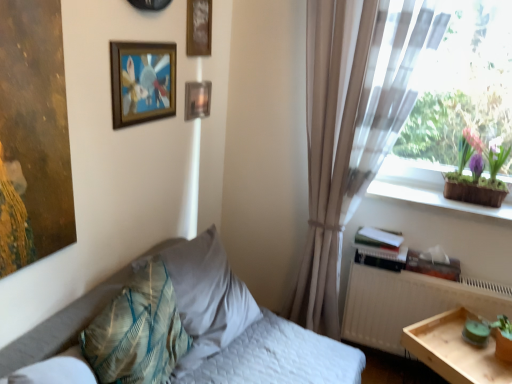
Question: From their relative heights in the image, would you say textured beige pillow at center-left, arranged as the second pillow when viewed from the front, is taller or shorter than white matte radiator at right?

Choices:
 (A) tall
 (B) short

Answer: (B)

Question: Looking at the image, does textured beige pillow at center-left, arranged as the second pillow when viewed from the front, seem bigger or smaller compared to white matte radiator at right?

Choices:
 (A) big
 (B) small

Answer: (A)

Question: Which of these objects is positioned farthest from the textured beige pillow at center-left, the 1th pillow when ordered from back to front?

Choices:
 (A) purple clay pot at window
 (B) wooden picture frame at upper center, arranged as the second picture frame when viewed from the front
 (C) white quilted bed at lower left
 (D) metallic rectangular frame at upper center, the first picture frame viewed from the back
 (E) textured teal pillow at lower left, positioned as the 1th pillow in front-to-back order

Answer: (A)

Question: Which of these objects is positioned closest to the beige sheer curtain at right?

Choices:
 (A) purple clay pot at window
 (B) metallic rectangular frame at upper center, the first picture frame viewed from the back
 (C) white quilted bed at lower left
 (D) wooden frame at upper left, which is the third picture frame from back to front
 (E) light wood tray at lower right

Answer: (A)